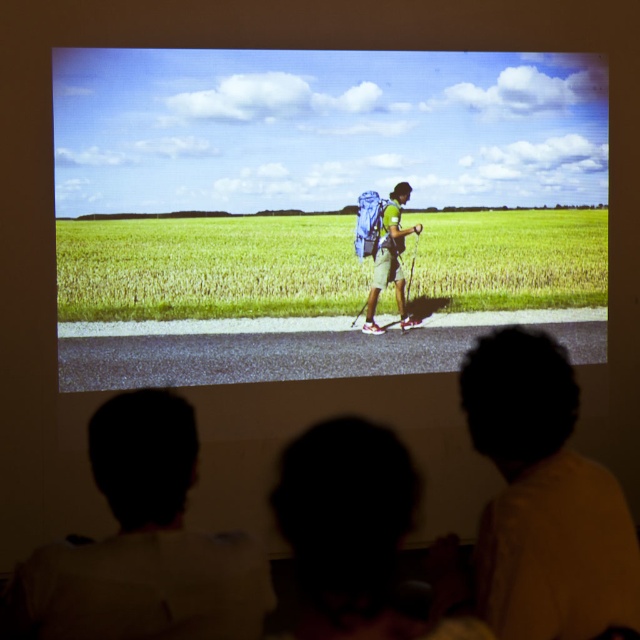
Between point (524, 637) and point (88, 564), which one is positioned behind?

Point (88, 564)

Does matte yellow shirt at lower right have a greater height compared to silhouette hair at lower left?

Yes.

Find the location of a particular element. matte yellow shirt at lower right is located at coordinates (544, 499).

Can you confirm if matte yellow shirt at lower right is taller than green matte backpack at center?

In fact, matte yellow shirt at lower right may be shorter than green matte backpack at center.

Can you confirm if matte yellow shirt at lower right is thinner than green matte backpack at center?

No.

Between point (560, 525) and point (403, 285), which one is positioned behind?

The point (403, 285) is behind.

You are a GUI agent. You are given a task and a screenshot of the screen. Output one action in this format:
    pyautogui.click(x=<x>, y=<y>)
    Task: Click on the matte yellow shirt at lower right
    
    Given the screenshot: What is the action you would take?
    pyautogui.click(x=544, y=499)

Is green fabric backpack at center smaller than matte yellow shirt at lower right?

No.

Between point (362, 360) and point (497, 372), which one is positioned in front?

Point (497, 372) is in front.

Find the location of a particular element. The image size is (640, 640). green fabric backpack at center is located at coordinates (321, 209).